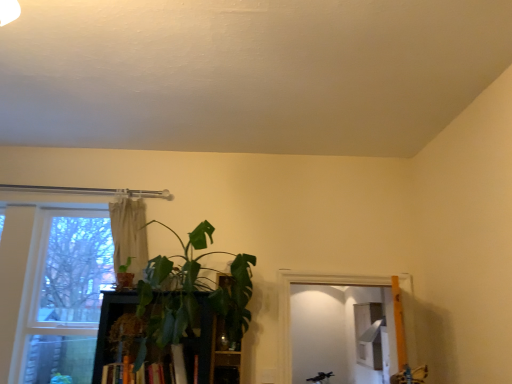
Find the location of a particular element. clear glass window at left is located at coordinates (52, 289).

The height and width of the screenshot is (384, 512). What do you see at coordinates (52, 289) in the screenshot? I see `clear glass window at left` at bounding box center [52, 289].

What is the approximate height of green leafy plant at center, which is the 2th houseplant from left to right?

It is 33.47 inches.

This screenshot has height=384, width=512. Describe the element at coordinates (224, 355) in the screenshot. I see `green leafy plant at center` at that location.

The image size is (512, 384). What do you see at coordinates (147, 370) in the screenshot? I see `hardcover book at center` at bounding box center [147, 370].

The width and height of the screenshot is (512, 384). In order to click on beige fabric curtain at upper center in this screenshot , I will do coord(129,236).

Locate an element on the screen. The height and width of the screenshot is (384, 512). green matte plant at left, the 1th houseplant when ordered from left to right is located at coordinates (124, 276).

You are a GUI agent. You are given a task and a screenshot of the screen. Output one action in this format:
    pyautogui.click(x=<x>, y=<y>)
    Task: Click on the clear glass window at left
    This screenshot has width=512, height=384.
    Given the screenshot: What is the action you would take?
    pyautogui.click(x=52, y=289)

In terms of height, does clear glass window at left look taller or shorter compared to green matte plant at left, the 1th houseplant when ordered from left to right?

clear glass window at left is taller than green matte plant at left, the 1th houseplant when ordered from left to right.

Identify the location of houseplant that is the 1st object to the right of the clear glass window at left, starting at the anchor. The height and width of the screenshot is (384, 512). (124, 276).

Is clear glass window at left facing towards green matte plant at left, the second houseplant from the right?

Yes, clear glass window at left is facing green matte plant at left, the second houseplant from the right.

Would you say clear glass window at left contains green matte plant at left, the 1th houseplant when ordered from left to right?

That's incorrect, green matte plant at left, the 1th houseplant when ordered from left to right, is not inside clear glass window at left.

Is hardcover book at center in front of green matte plant at left, the 1th houseplant when ordered from left to right?

Yes, it is in front of green matte plant at left, the 1th houseplant when ordered from left to right.

Can you confirm if hardcover book at center is thinner than green matte plant at left, the second houseplant from the right?

In fact, hardcover book at center might be wider than green matte plant at left, the second houseplant from the right.

From the image's perspective, is hardcover book at center located above or below green matte plant at left, the 1th houseplant when ordered from left to right?

Clearly, from the image's perspective, hardcover book at center is below green matte plant at left, the 1th houseplant when ordered from left to right.

Is hardcover book at center next to green matte plant at left, the 1th houseplant when ordered from left to right, and touching it?

No, hardcover book at center is not in contact with green matte plant at left, the 1th houseplant when ordered from left to right.

Does green matte plant at left, the 1th houseplant when ordered from left to right, turn towards green leafy plant at center?

No, green matte plant at left, the 1th houseplant when ordered from left to right, is not turned towards green leafy plant at center.

Locate an element on the screen. The width and height of the screenshot is (512, 384). shelf located below the green matte plant at left, the second houseplant from the right (from the image's perspective) is located at coordinates (224, 355).

From a real-world perspective, is green matte plant at left, the 1th houseplant when ordered from left to right, over green leafy plant at center?

Yes.

From the picture: Which object is wider, green matte plant at left, the second houseplant from the right, or green leafy plant at center?

green leafy plant at center is wider.

Is green leafy plant at center, which is counted as the first houseplant, starting from the right, inside or outside of beige fabric curtain at upper center?

green leafy plant at center, which is counted as the first houseplant, starting from the right, is located beyond the bounds of beige fabric curtain at upper center.

Which point is more distant from viewer, (248, 286) or (134, 226)?

The point (134, 226) is more distant.

From the image's perspective, would you say green leafy plant at center, which is counted as the first houseplant, starting from the right, is shown under beige fabric curtain at upper center?

Yes.

The image size is (512, 384). Identify the location of curtain above the green leafy plant at center, which is the 2th houseplant from left to right (from a real-world perspective). (x=129, y=236).

Considering the positions of point (131, 363) and point (141, 276), is point (131, 363) closer or farther from the camera than point (141, 276)?

Clearly, point (131, 363) is closer to the camera than point (141, 276).

From a real-world perspective, which object stands above the other?

beige fabric curtain at upper center is physically above.

In terms of width, does hardcover book at center look wider or thinner when compared to beige fabric curtain at upper center?

hardcover book at center is wider than beige fabric curtain at upper center.

How different are the orientations of hardcover book at center and beige fabric curtain at upper center in degrees?

The angular difference between hardcover book at center and beige fabric curtain at upper center is 2.99 degrees.

Considering the positions of objects green leafy plant at center and clear glass window at left in the image provided, who is more to the left, green leafy plant at center or clear glass window at left?

clear glass window at left is more to the left.

Is green leafy plant at center not near clear glass window at left?

Indeed, green leafy plant at center is not near clear glass window at left.

From a real-world perspective, is green leafy plant at center physically above clear glass window at left?

No, from a real-world perspective, green leafy plant at center is not on top of clear glass window at left.

Is green leafy plant at center spatially inside clear glass window at left, or outside of it?

green leafy plant at center is spatially situated outside clear glass window at left.

Could you tell me if clear glass window at left is turned towards beige fabric curtain at upper center?

Yes, clear glass window at left is oriented towards beige fabric curtain at upper center.

Is clear glass window at left wider than beige fabric curtain at upper center?

Yes.

Can you confirm if clear glass window at left is smaller than beige fabric curtain at upper center?

No, clear glass window at left is not smaller than beige fabric curtain at upper center.

Which point is more forward, (26, 306) or (135, 205)?

The point (135, 205) is closer.

Where is `houseplant above the clear glass window at left (from a real-world perspective)`? The height and width of the screenshot is (384, 512). houseplant above the clear glass window at left (from a real-world perspective) is located at coordinates (124, 276).

The image size is (512, 384). I want to click on the 2nd houseplant above the hardcover book at center (from the image's perspective), so click(124, 276).

Based on their spatial positions, is green matte plant at left, the 1th houseplant when ordered from left to right, or hardcover book at center further from beige fabric curtain at upper center?

The object further to beige fabric curtain at upper center is hardcover book at center.

When comparing their distances from green leafy plant at center, which is counted as the first houseplant, starting from the right, does hardcover book at center or green matte plant at left, the 1th houseplant when ordered from left to right, seem closer?

Among the two, hardcover book at center is located nearer to green leafy plant at center, which is counted as the first houseplant, starting from the right.

Which object lies nearer to the anchor point green matte plant at left, the second houseplant from the right, beige fabric curtain at upper center or green leafy plant at center, which is the 2th houseplant from left to right?

beige fabric curtain at upper center lies closer to green matte plant at left, the second houseplant from the right, than the other object.

From the picture: When comparing their distances from beige fabric curtain at upper center, does green leafy plant at center or hardcover book at center seem further?

green leafy plant at center is positioned further to the anchor beige fabric curtain at upper center.

Based on their spatial positions, is green leafy plant at center or beige fabric curtain at upper center closer to clear glass window at left?

beige fabric curtain at upper center.

Based on their spatial positions, is hardcover book at center or clear glass window at left further from green leafy plant at center, which is the 2th houseplant from left to right?

The object further to green leafy plant at center, which is the 2th houseplant from left to right, is clear glass window at left.

Estimate the real-world distances between objects in this image. Which object is further from green leafy plant at center, which is counted as the first houseplant, starting from the right, green matte plant at left, the 1th houseplant when ordered from left to right, or hardcover book at center?

Based on the image, green matte plant at left, the 1th houseplant when ordered from left to right, appears to be further to green leafy plant at center, which is counted as the first houseplant, starting from the right.

From the image, which object appears to be farther from green leafy plant at center, beige fabric curtain at upper center or hardcover book at center?

The object further to green leafy plant at center is beige fabric curtain at upper center.

This screenshot has height=384, width=512. In order to click on houseplant between green matte plant at left, the second houseplant from the right, and hardcover book at center vertically in this screenshot , I will do `click(191, 295)`.

Where is `curtain between clear glass window at left and green leafy plant at center, which is the 2th houseplant from left to right, from left to right`? This screenshot has width=512, height=384. curtain between clear glass window at left and green leafy plant at center, which is the 2th houseplant from left to right, from left to right is located at coordinates (129, 236).

The height and width of the screenshot is (384, 512). Identify the location of houseplant between clear glass window at left and hardcover book at center in the horizontal direction. (124, 276).

This screenshot has height=384, width=512. In order to click on book between green matte plant at left, the 1th houseplant when ordered from left to right, and green leafy plant at center from left to right in this screenshot , I will do tap(147, 370).